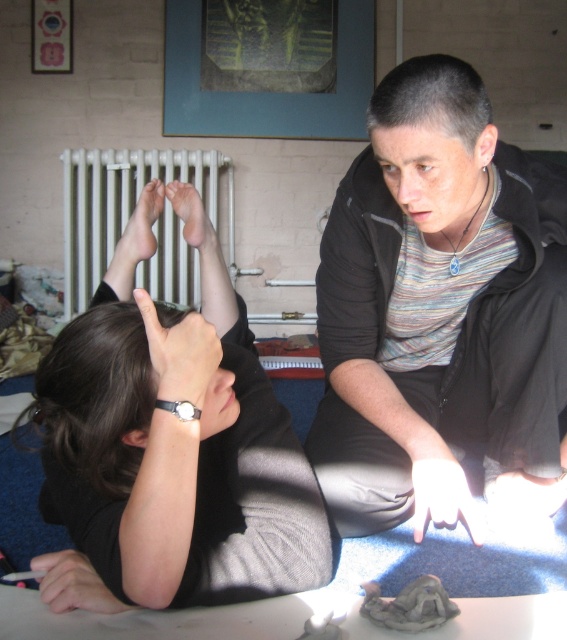
Question: Does black leather watch at upper center appear on the right side of matte skin foot at upper center?

Choices:
 (A) no
 (B) yes

Answer: (B)

Question: Which is farther from the black leather watch at upper center?

Choices:
 (A) matte skin foot at upper center
 (B) smooth skin hand at lower left
 (C) matte white hand at lower center

Answer: (C)

Question: Which of these objects is positioned closest to the matte skin foot at upper center?

Choices:
 (A) matte skin feet at upper center
 (B) white matte hand at center
 (C) matte white hand at lower center
 (D) smooth skin hand at lower left

Answer: (A)

Question: Can you confirm if black matte sweater at upper left is positioned above matte skin foot at upper center?

Choices:
 (A) yes
 (B) no

Answer: (B)

Question: Which of the following is the closest to the observer?

Choices:
 (A) (196, 246)
 (B) (159, 202)

Answer: (B)

Question: Can you confirm if black matte jacket at center is positioned above black matte sweater at upper left?

Choices:
 (A) yes
 (B) no

Answer: (A)